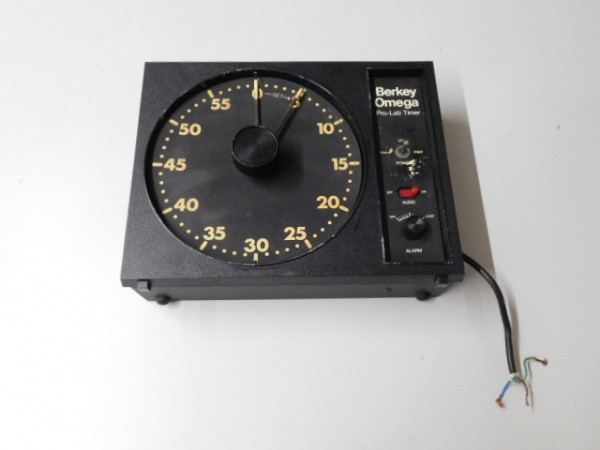
Identify the location of timer. This screenshot has width=600, height=450. (345, 93).